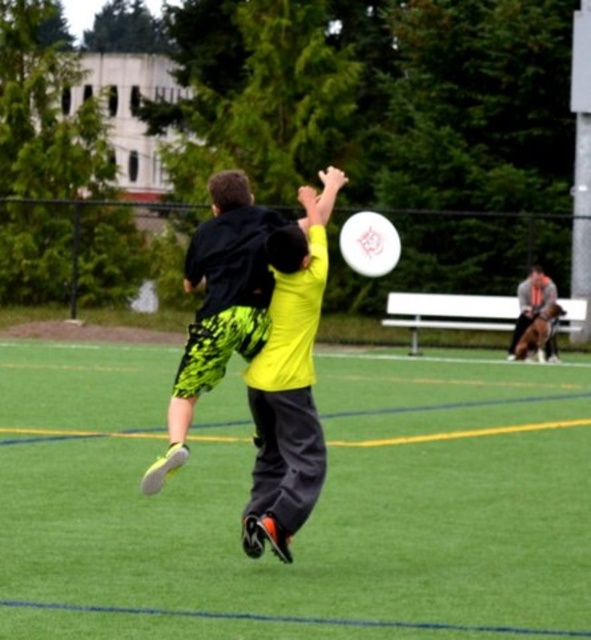
Question: Which point is farther from the camera taking this photo?

Choices:
 (A) (363, 566)
 (B) (376, 220)
 (C) (519, 301)

Answer: (B)

Question: Among these points, which one is farthest from the camera?

Choices:
 (A) (202, 240)
 (B) (369, 269)
 (C) (530, 285)

Answer: (B)

Question: Can you confirm if green artificial turf at center is bigger than neon yellow jersey at center?

Choices:
 (A) yes
 (B) no

Answer: (A)

Question: Among these points, which one is nearest to the camera?

Choices:
 (A) (384, 236)
 (B) (410, 616)

Answer: (B)

Question: Can you confirm if neon green shorts at center is positioned above smooth gray shirt at upper right?

Choices:
 (A) yes
 (B) no

Answer: (B)

Question: Is neon yellow jersey at center positioned in front of smooth gray shirt at upper right?

Choices:
 (A) yes
 (B) no

Answer: (A)